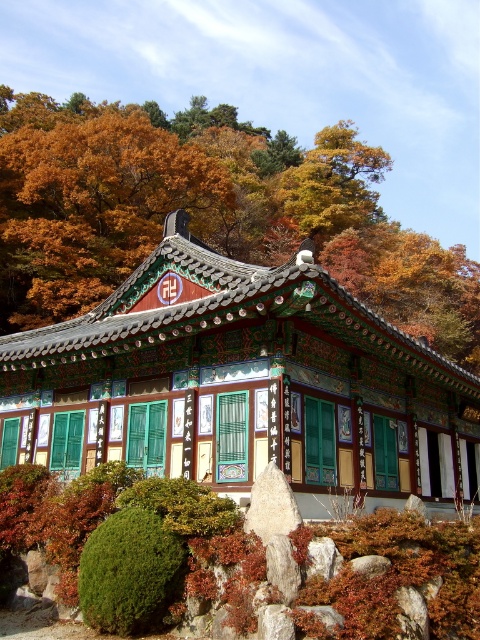
You are standing in front of a traditional Korean building with a vibrant roof and festive decorations. You notice a specific point marked at coordinates point [260,465]. Considering the building is 52.66 feet away from you, would you need to move closer to examine this point more closely?

The point [260,465] is 52.66 feet away from the viewer. Since this distance might be too far to examine the point closely without assistance, moving closer would allow for a better view.

You are an artist planning to paint the autumn scene in front of you. You notice the autumn leaves at upper center and the green fuzzy bush at lower left. Which object should you paint first if you want to start with the larger one?

The autumn leaves at upper center should be painted first since they are larger than the green fuzzy bush at lower left according to the description.